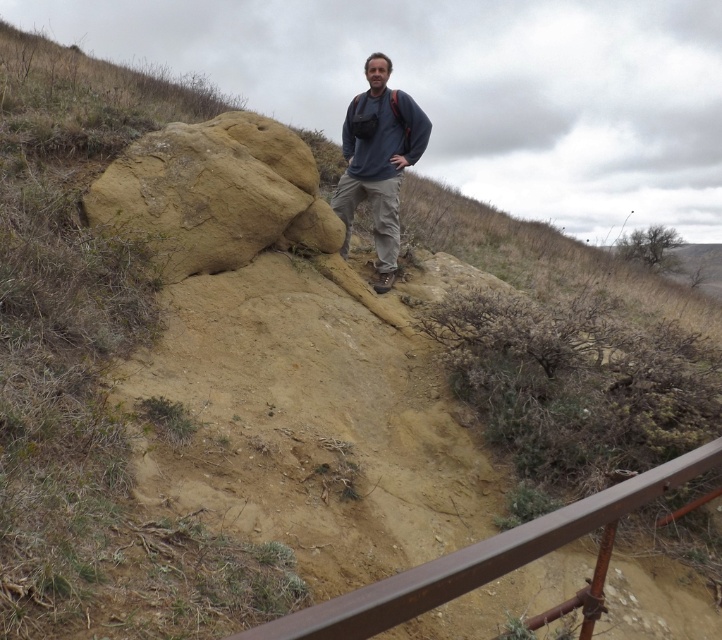
Question: Can you confirm if brown metal/rustic rail at lower right is positioned to the left of dark blue sweater at center?

Choices:
 (A) yes
 (B) no

Answer: (B)

Question: Which is nearer to the dark blue sweater at center?

Choices:
 (A) sandy beige rock at center
 (B) brown metal/rustic rail at lower right

Answer: (A)

Question: From the image, what is the correct spatial relationship of sandy beige rock at center in relation to dark blue sweater at center?

Choices:
 (A) left
 (B) right

Answer: (A)

Question: Among these points, which one is nearest to the camera?

Choices:
 (A) (391, 605)
 (B) (352, 108)
 (C) (175, 220)

Answer: (A)

Question: Considering the real-world distances, which object is closest to the dark blue sweater at center?

Choices:
 (A) sandy beige rock at center
 (B) brown metal/rustic rail at lower right

Answer: (A)

Question: Is sandy beige rock at center thinner than brown metal/rustic rail at lower right?

Choices:
 (A) no
 (B) yes

Answer: (B)